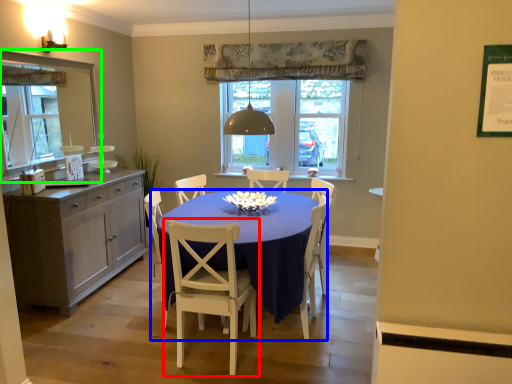
Question: Which object is positioned farthest from chair (highlighted by a red box)? Select from desk (highlighted by a blue box) and mirror (highlighted by a green box).

Choices:
 (A) desk
 (B) mirror

Answer: (B)